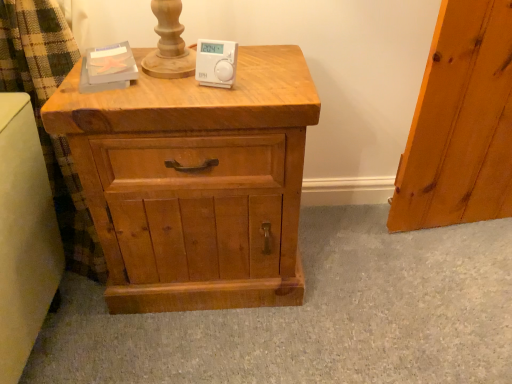
Locate an element on the screen. vacant area to the right of natural wood chest of drawers at center is located at coordinates (346, 289).